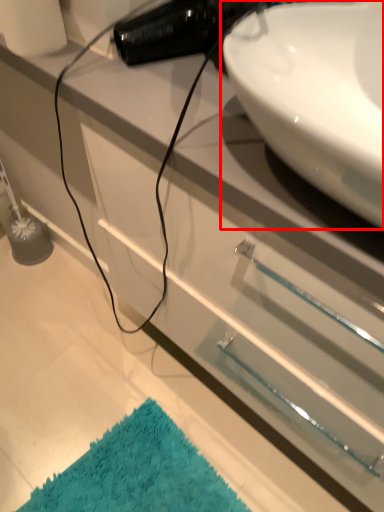
Question: From the image's perspective, what is the correct spatial relationship of sink (annotated by the red box) in relation to bath mat?

Choices:
 (A) above
 (B) below

Answer: (A)